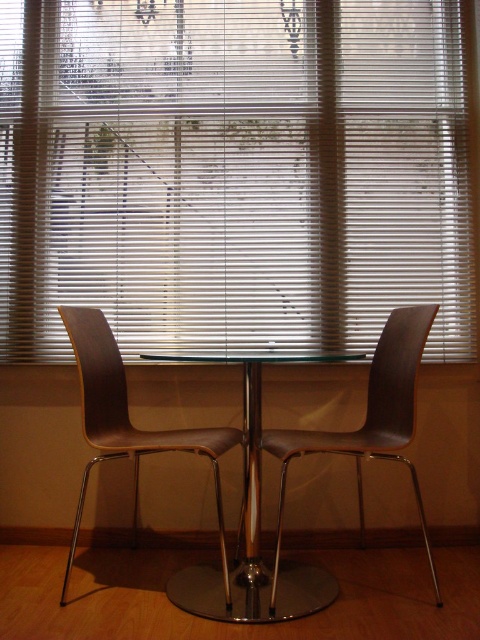
Question: Estimate the real-world distances between objects in this image. Which object is closer to the matte wood swivel chair at left?

Choices:
 (A) white matte blinds at center
 (B) clear glass table at center
 (C) brown matte swivel chair at center

Answer: (B)

Question: Which of the following is the farthest from the observer?

Choices:
 (A) matte wood swivel chair at left
 (B) brown matte swivel chair at center
 (C) white matte blinds at center
 (D) clear glass table at center

Answer: (C)

Question: Can you confirm if white matte blinds at center is positioned to the left of brown matte swivel chair at center?

Choices:
 (A) no
 (B) yes

Answer: (B)

Question: Which object is the farthest from the white matte blinds at center?

Choices:
 (A) brown matte swivel chair at center
 (B) matte wood swivel chair at left

Answer: (B)

Question: Can you confirm if clear glass table at center is bigger than brown matte swivel chair at center?

Choices:
 (A) yes
 (B) no

Answer: (A)

Question: In this image, where is clear glass table at center located relative to brown matte swivel chair at center?

Choices:
 (A) below
 (B) above

Answer: (A)